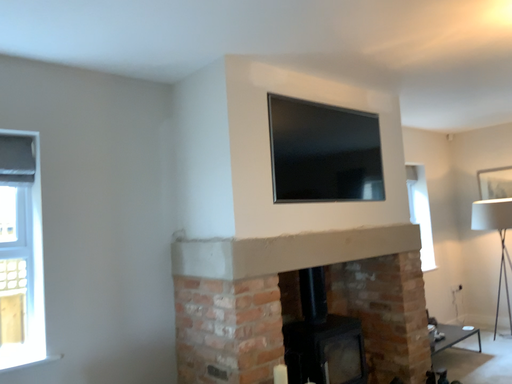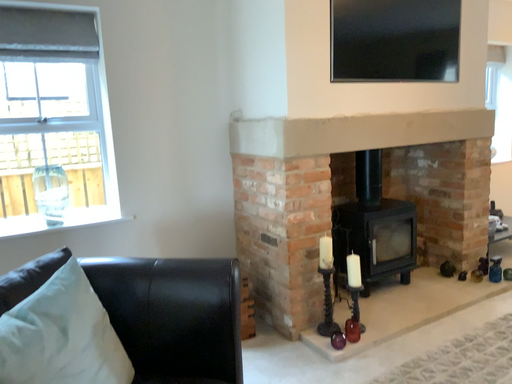
Question: Which way did the camera rotate in the video?

Choices:
 (A) rotated downward
 (B) rotated upward

Answer: (A)